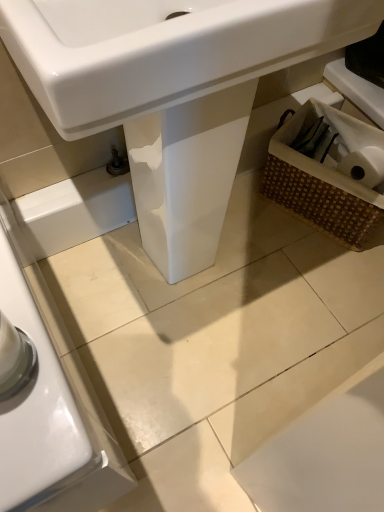
What do you see at coordinates (172, 90) in the screenshot? I see `white glossy sink at center` at bounding box center [172, 90].

Image resolution: width=384 pixels, height=512 pixels. What do you see at coordinates (341, 143) in the screenshot? I see `woven brown basket at lower right` at bounding box center [341, 143].

Identify the location of woven brown basket at lower right. (341, 143).

You are a GUI agent. You are given a task and a screenshot of the screen. Output one action in this format:
    pyautogui.click(x=<x>, y=<y>)
    Task: Click on the woven brown basket at lower right
    The width and height of the screenshot is (384, 512).
    Given the screenshot: What is the action you would take?
    pyautogui.click(x=328, y=172)

Locate an element on the screen. Image resolution: width=384 pixels, height=512 pixels. white glossy sink at center is located at coordinates (172, 90).

From the picture: From a real-world perspective, is white glossy sink at center on woven brown basket at lower right?

Yes.

Is white glossy sink at center bigger than woven brown basket at lower right?

Yes.

What's the angular difference between white glossy sink at center and woven brown basket at lower right's facing directions?

65.2 degrees.

Would you say white glossy sink at center is a long distance from woven brown basket at lower right?

white glossy sink at center is actually quite close to woven brown basket at lower right.

Image resolution: width=384 pixels, height=512 pixels. In the image, there is a woven brown basket at lower right. Find the location of `basket below it (from the image's perspective)`. basket below it (from the image's perspective) is located at coordinates (328, 172).

Is woven brown basket at lower right positioned beyond the bounds of woven brown basket at lower right?

woven brown basket at lower right lies outside woven brown basket at lower right's area.

From a real-world perspective, is woven brown basket at lower right positioned under woven brown basket at lower right based on gravity?

Correct, in the physical world, woven brown basket at lower right is lower than woven brown basket at lower right.

From the image's perspective, which one is positioned lower, white glossy sink at center or woven brown basket at lower right?

white glossy sink at center, from the image's perspective.

Considering the sizes of objects white glossy sink at center and woven brown basket at lower right in the image provided, who is taller, white glossy sink at center or woven brown basket at lower right?

With more height is white glossy sink at center.

Can we say white glossy sink at center lies outside woven brown basket at lower right?

Indeed, white glossy sink at center is completely outside woven brown basket at lower right.

Is woven brown basket at lower right facing away from white glossy sink at center?

No, woven brown basket at lower right's orientation is not away from white glossy sink at center.

Which object is further away from the camera taking this photo, woven brown basket at lower right or white glossy sink at center?

woven brown basket at lower right is further away from the camera.

Visually, is woven brown basket at lower right positioned to the left or to the right of white glossy sink at center?

From the image, it's evident that woven brown basket at lower right is to the right of white glossy sink at center.

Which is closer, (371, 145) or (155, 68)?

Point (371, 145) is farther from the camera than point (155, 68).

From a real-world perspective, which object rests below the other?

In real-world perspective, woven brown basket at lower right is lower.

Between woven brown basket at lower right and white glossy sink at center, which one is positioned behind?

woven brown basket at lower right is more distant.

The image size is (384, 512). What are the coordinates of `sink above the woven brown basket at lower right (from a real-world perspective)` in the screenshot? It's located at (172, 90).

Is woven brown basket at lower right located outside white glossy sink at center?

Yes, woven brown basket at lower right is outside of white glossy sink at center.

Which is in front, point (329, 117) or point (309, 126)?

Positioned in front is point (309, 126).

From the image's perspective, which one is positioned higher, woven brown basket at lower right or woven brown basket at lower right?

woven brown basket at lower right is shown above in the image.

Which object is further away from the camera, woven brown basket at lower right or woven brown basket at lower right?

Positioned behind is woven brown basket at lower right.

The width and height of the screenshot is (384, 512). In order to click on basket above the white glossy sink at center (from the image's perspective) in this screenshot , I will do `click(328, 172)`.

I want to click on basket that appears below the woven brown basket at lower right (from the image's perspective), so click(328, 172).

Looking at the image, which one is located further to woven brown basket at lower right, woven brown basket at lower right or white glossy sink at center?

The object further to woven brown basket at lower right is white glossy sink at center.

Considering their positions, is white glossy sink at center positioned closer to woven brown basket at lower right than woven brown basket at lower right?

woven brown basket at lower right.

Which object lies further to the anchor point woven brown basket at lower right, woven brown basket at lower right or white glossy sink at center?

white glossy sink at center is positioned further to the anchor woven brown basket at lower right.

Which object lies further to the anchor point white glossy sink at center, woven brown basket at lower right or woven brown basket at lower right?

The object further to white glossy sink at center is woven brown basket at lower right.

Considering their positions, is woven brown basket at lower right positioned closer to white glossy sink at center than woven brown basket at lower right?

Among the two, woven brown basket at lower right is located nearer to white glossy sink at center.

From the image, which object appears to be farther from woven brown basket at lower right, white glossy sink at center or woven brown basket at lower right?

Based on the image, white glossy sink at center appears to be further to woven brown basket at lower right.

At what (x,y) coordinates should I click in order to perform the action: click on basket between white glossy sink at center and woven brown basket at lower right along the z-axis. Please return your answer as a coordinate pair (x, y). The image size is (384, 512). Looking at the image, I should click on (328, 172).